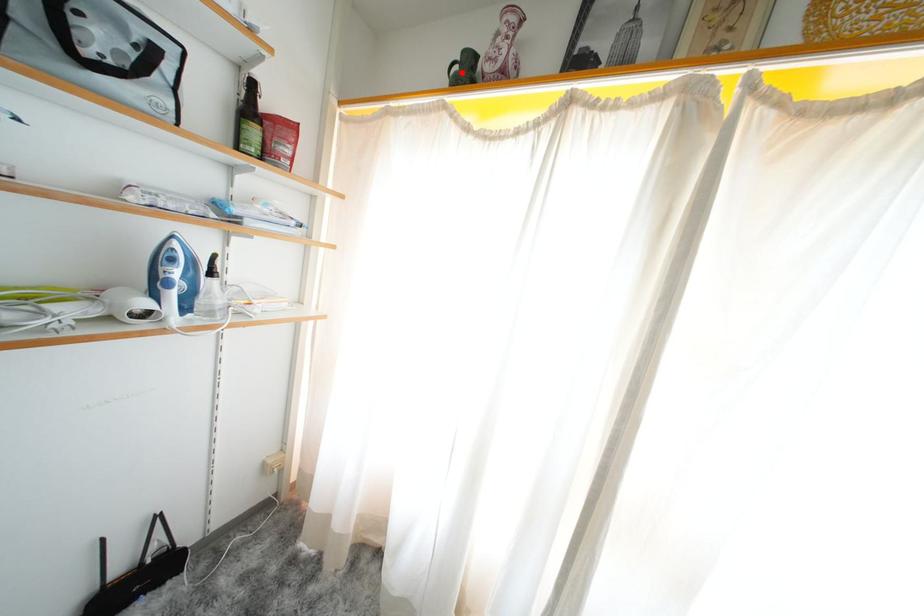
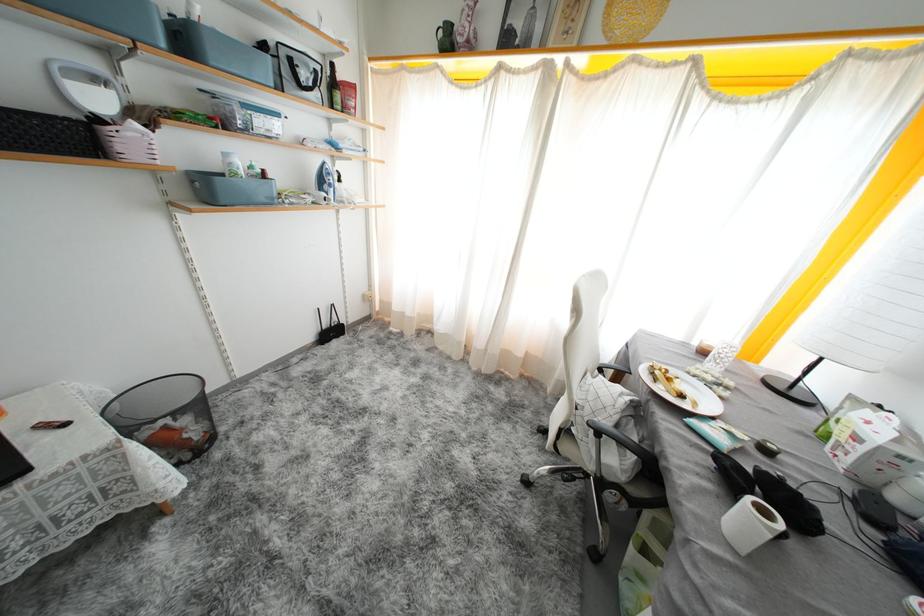
Find the pixel in the second image that matches the highlighted location in the first image.

(446, 37)